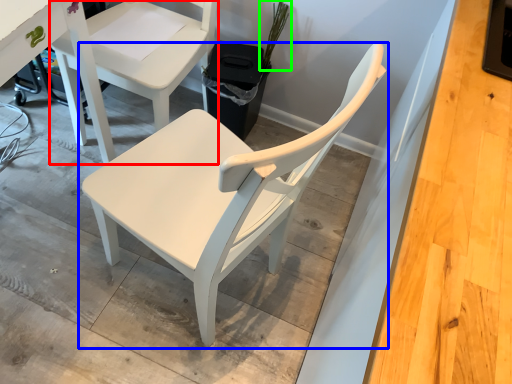
Question: Which is nearer to the chair (highlighted by a red box)? chair (highlighted by a blue box) or plant (highlighted by a green box).

Choices:
 (A) chair
 (B) plant

Answer: (B)